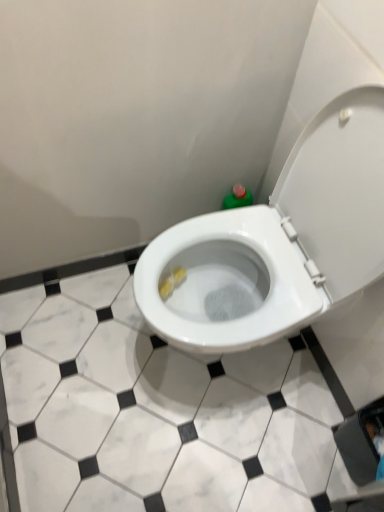
Question: Considering the relative positions of white glossy tile at center and white glossy toilet at center in the image provided, is white glossy tile at center behind white glossy toilet at center?

Choices:
 (A) yes
 (B) no

Answer: (A)

Question: Are white glossy tile at center and white glossy toilet at center making contact?

Choices:
 (A) yes
 (B) no

Answer: (B)

Question: Is white glossy tile at center to the left of white glossy toilet at center from the viewer's perspective?

Choices:
 (A) yes
 (B) no

Answer: (A)

Question: Is white glossy toilet at center surrounded by white glossy tile at center?

Choices:
 (A) no
 (B) yes

Answer: (A)

Question: Does white glossy tile at center have a greater height compared to white glossy toilet at center?

Choices:
 (A) no
 (B) yes

Answer: (A)

Question: Does white glossy tile at center appear on the right side of white glossy toilet at center?

Choices:
 (A) yes
 (B) no

Answer: (B)

Question: Is white glossy toilet at center not within white glossy tile at center?

Choices:
 (A) yes
 (B) no

Answer: (A)

Question: From the image's perspective, is white glossy toilet at center under white glossy tile at center?

Choices:
 (A) no
 (B) yes

Answer: (A)

Question: Is the depth of white glossy toilet at center less than that of white glossy tile at center?

Choices:
 (A) yes
 (B) no

Answer: (A)

Question: Is white glossy tile at center at the back of white glossy toilet at center?

Choices:
 (A) yes
 (B) no

Answer: (B)

Question: Is white glossy toilet at center further to the viewer compared to white glossy tile at center?

Choices:
 (A) no
 (B) yes

Answer: (A)

Question: From a real-world perspective, is white glossy toilet at center beneath white glossy tile at center?

Choices:
 (A) yes
 (B) no

Answer: (B)

Question: Which is correct: white glossy toilet at center is inside white glossy tile at center, or outside of it?

Choices:
 (A) outside
 (B) inside

Answer: (A)